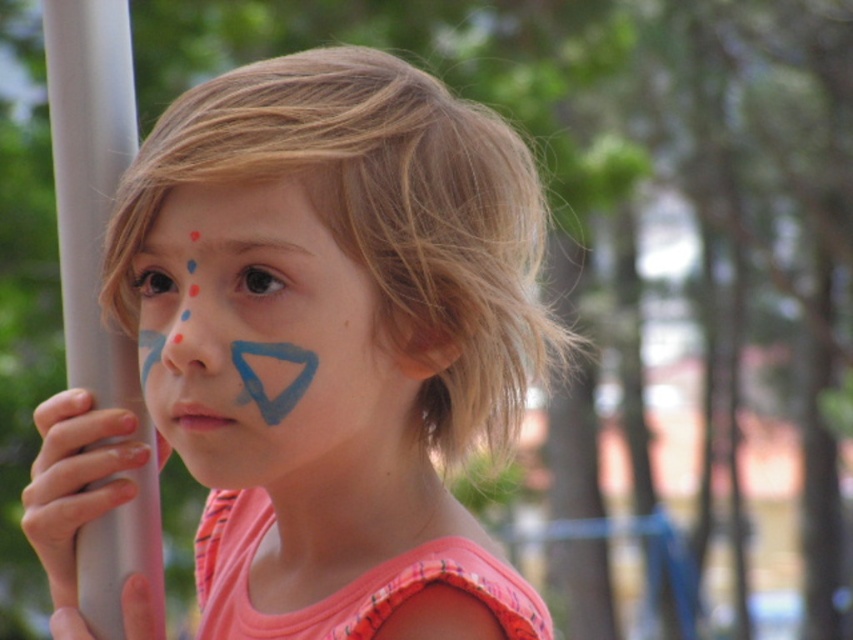
Question: Does blue matte triangle at center have a larger size compared to white plastic pole at left?

Choices:
 (A) no
 (B) yes

Answer: (B)

Question: Estimate the real-world distances between objects in this image. Which object is farther from the white matte pole at left?

Choices:
 (A) white plastic pole at left
 (B) matte blue face paint at center
 (C) blue matte triangle at center
 (D) smooth gray pole at left

Answer: (B)

Question: Does matte blue face paint at center appear on the right side of white plastic pole at left?

Choices:
 (A) yes
 (B) no

Answer: (A)

Question: Does matte blue face paint at center appear on the left side of white plastic pole at left?

Choices:
 (A) no
 (B) yes

Answer: (A)

Question: Which is farther from the smooth gray pole at left?

Choices:
 (A) blue matte triangle at center
 (B) white matte pole at left
 (C) matte blue face paint at center
 (D) white plastic pole at left

Answer: (C)

Question: Which object is closer to the camera taking this photo?

Choices:
 (A) smooth gray pole at left
 (B) white matte pole at left
 (C) white plastic pole at left
 (D) matte blue face paint at center

Answer: (D)